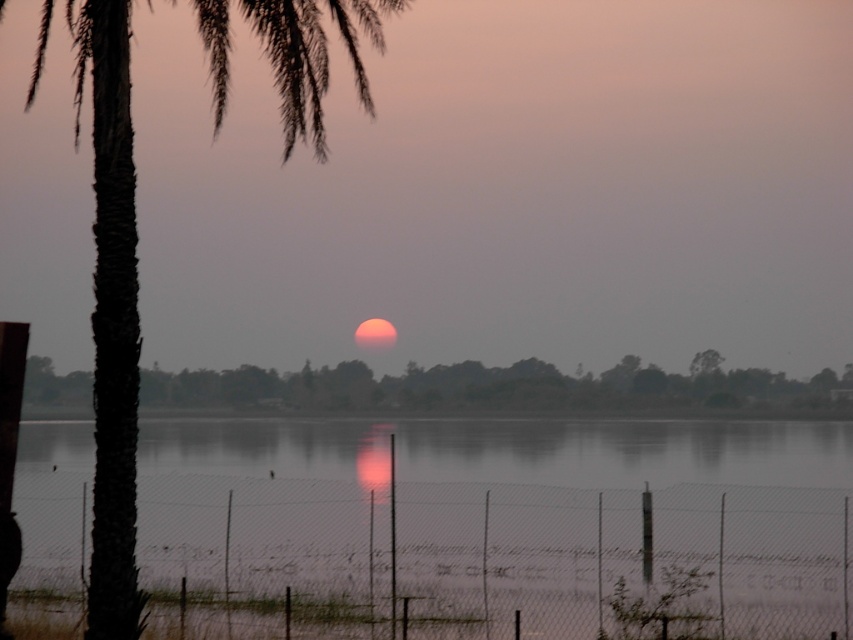
Question: Considering the relative positions of wire mesh fence at lower center and green leafy tree at center in the image provided, where is wire mesh fence at lower center located with respect to green leafy tree at center?

Choices:
 (A) above
 (B) below

Answer: (B)

Question: Which object is closer to the camera taking this photo?

Choices:
 (A) dark brown textured palm tree at left
 (B) green leafy tree at center
 (C) wire mesh fence at lower center

Answer: (A)

Question: Can you confirm if wire mesh fence at lower center is positioned to the right of green leafy tree at center?

Choices:
 (A) yes
 (B) no

Answer: (B)

Question: From the image, what is the correct spatial relationship of wire mesh fence at lower center in relation to green leafy tree at center?

Choices:
 (A) right
 (B) left

Answer: (B)

Question: Which of these objects is positioned closest to the wire mesh fence at lower center?

Choices:
 (A) green leafy tree at center
 (B) dark brown textured palm tree at left

Answer: (B)

Question: Which of the following is the closest to the observer?

Choices:
 (A) (119, 195)
 (B) (289, 397)
 (C) (331, 483)

Answer: (A)